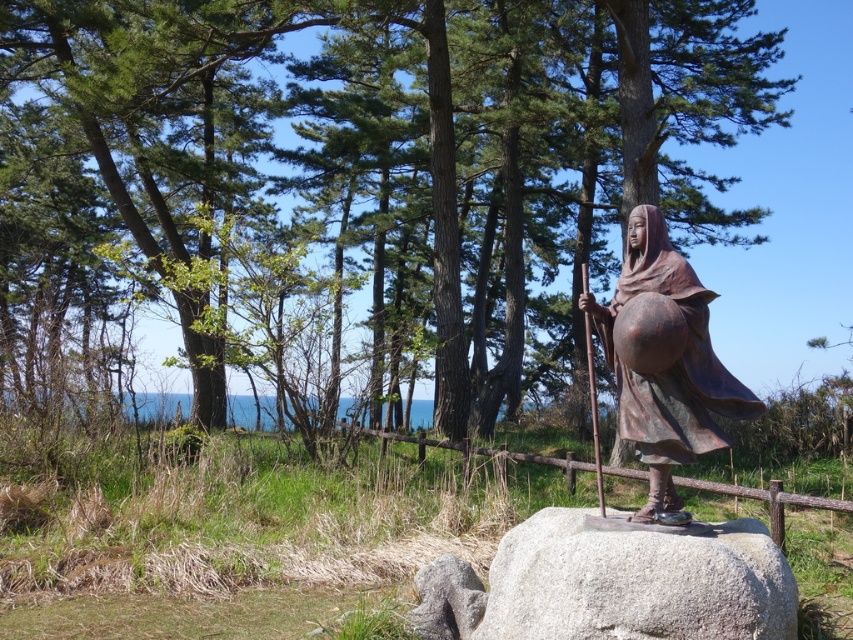
You are a hiker who wants to take a photo of the statue on the gray granite boulder at center and the brown wooden rail at center. Which object should you position closer to the camera to ensure both are in focus?

To ensure both the gray granite boulder at center and the brown wooden rail at center are in focus, you should position the gray granite boulder at center closer to the camera since it is to the left of the brown wooden rail at center, which means it is farther away.

You are standing in front of the statue on the gray granite boulder at center. Your friend is standing 15 feet away from you. Can your friend see the statue clearly from their position?

A: The gray granite boulder at center is 10.70 feet away from the camera. Since your friend is 15 feet away from you, they are farther than the distance to the boulder, so they can still see the statue clearly as long as there are no obstructions.

You are a park visitor standing at the base of the statue. You notice the gray granite boulder at center and the brown wooden rail at center. Which object is positioned higher from the ground?

The gray granite boulder at center is above the brown wooden rail at center, so the gray granite boulder at center is higher from the ground.